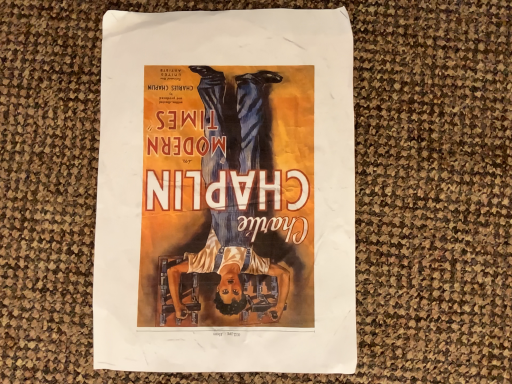
Image resolution: width=512 pixels, height=384 pixels. I want to click on blank space situated above matte paper poster at center (from a real-world perspective), so click(216, 178).